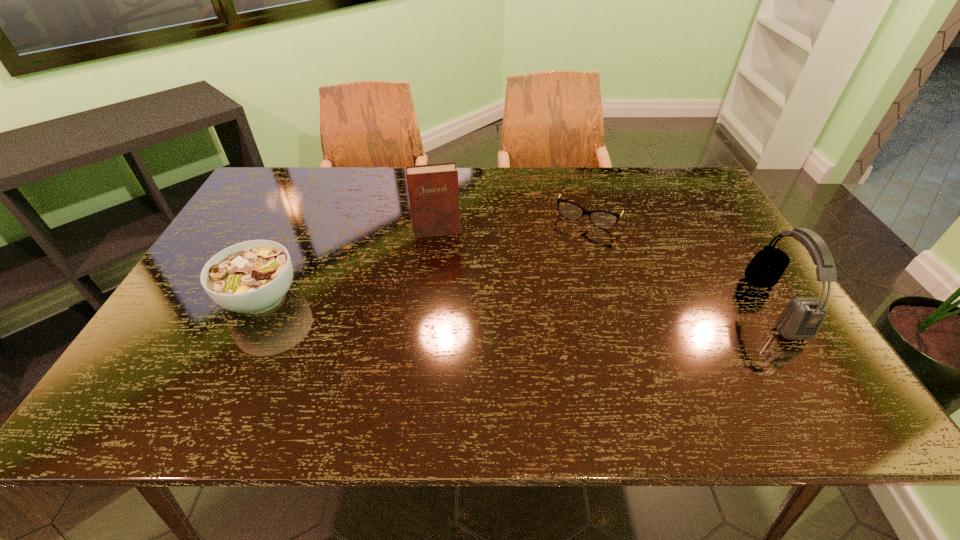
Identify the location of the leftmost object. (252, 277).

Locate an element on the screen. The width and height of the screenshot is (960, 540). the second shortest object is located at coordinates (252, 277).

What are the coordinates of `headset` in the screenshot? It's located at [801, 319].

The height and width of the screenshot is (540, 960). What are the coordinates of `diary` in the screenshot? It's located at (433, 192).

Identify the location of spectacles. (602, 219).

The height and width of the screenshot is (540, 960). I want to click on the second object from right to left, so click(x=602, y=219).

Locate an element on the screen. The image size is (960, 540). vacant space situated on the right of the third tallest object is located at coordinates (438, 298).

The height and width of the screenshot is (540, 960). Find the location of `vacant space positioned on the front cover of the second object from left to right`. vacant space positioned on the front cover of the second object from left to right is located at coordinates (449, 299).

The height and width of the screenshot is (540, 960). What are the coordinates of `free region located 0.370m on the front cover of the second object from left to right` in the screenshot? It's located at (456, 340).

In order to click on vacant region located 0.180m on the front cover of the second object from left to right in this screenshot , I will do `click(446, 282)`.